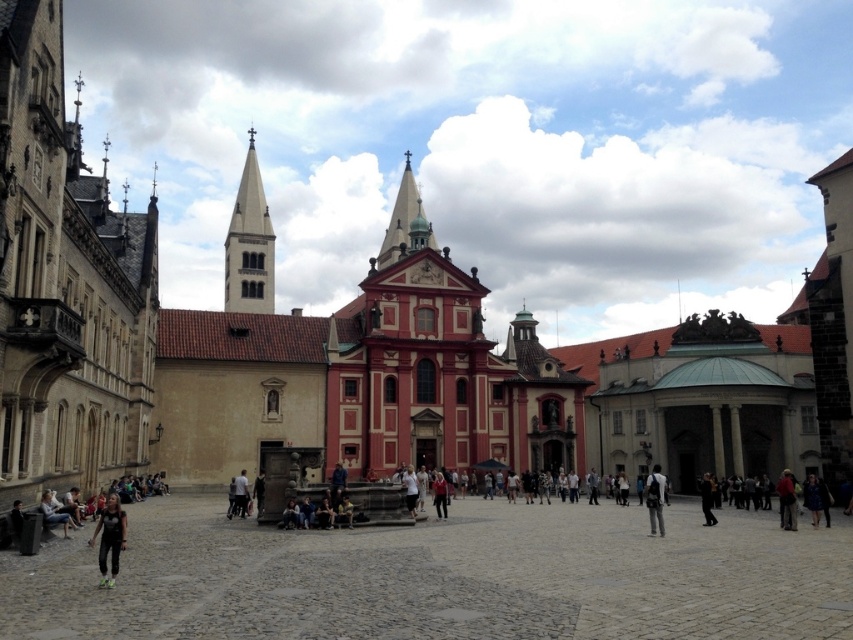
Question: Estimate the real-world distances between objects in this image. Which object is farther from the matte stone church at left?

Choices:
 (A) dark gray fabric pants at center
 (B) black athletic wear at lower left
 (C) cobblestone plaza at center

Answer: (C)

Question: Among these objects, which one is nearest to the camera?

Choices:
 (A) black athletic wear at lower left
 (B) gray stone tower at center
 (C) white fabric jacket at center
 (D) cobblestone plaza at center

Answer: (D)

Question: Which of these objects is positioned closest to the gray stone tower at center?

Choices:
 (A) matte pink building at center
 (B) black athletic wear at lower left
 (C) cobblestone plaza at center

Answer: (A)

Question: Where is matte stone church at left located in relation to black athletic wear at lower left in the image?

Choices:
 (A) above
 (B) below

Answer: (A)

Question: Is gray stone tower at center thinner than black leather jacket at center?

Choices:
 (A) no
 (B) yes

Answer: (A)

Question: Can you confirm if dark brown leather jacket at lower right is positioned below dark gray fabric pants at center?

Choices:
 (A) no
 (B) yes

Answer: (B)